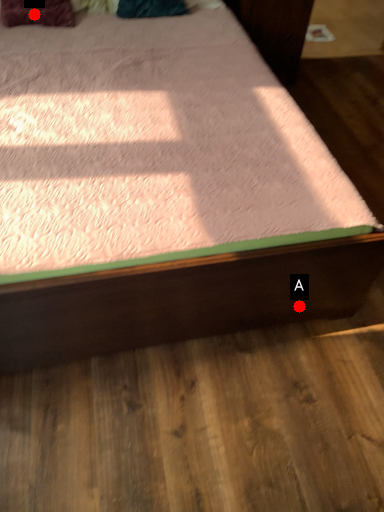
Question: Two points are circled on the image, labeled by A and B beside each circle. Which point is closer to the camera?

Choices:
 (A) A is closer
 (B) B is closer

Answer: (A)